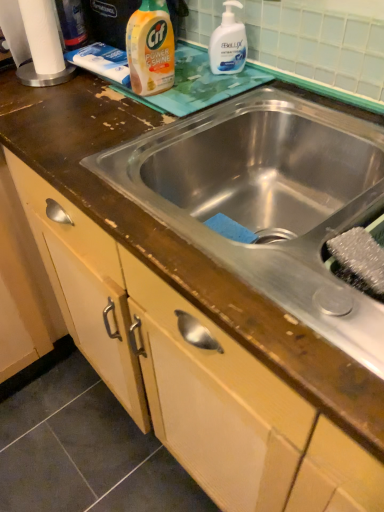
The height and width of the screenshot is (512, 384). I want to click on yellow plastic bottle at upper center, marked as the first cleaning product in a left-to-right arrangement, so click(150, 48).

What are the coordinates of `stainless steel sink at center` in the screenshot? It's located at (268, 200).

At what (x,y) coordinates should I click in order to perform the action: click on white paper towel at upper left. Please return your answer as a coordinate pair (x, y). This screenshot has width=384, height=512. Looking at the image, I should click on (42, 36).

Which object is closer to the camera taking this photo, stainless steel sink at center or white glossy hand soap at upper right, which ranks as the second cleaning product in left-to-right order?

stainless steel sink at center is in front.

Considering the relative positions of stainless steel sink at center and white glossy hand soap at upper right, the first cleaning product when ordered from right to left, in the image provided, is stainless steel sink at center to the left or to the right of white glossy hand soap at upper right, the first cleaning product when ordered from right to left,?

stainless steel sink at center is positioned on white glossy hand soap at upper right, the first cleaning product when ordered from right to left,'s right side.

Is point (196, 148) positioned behind point (227, 54)?

No, it is not.

Is stainless steel sink at center positioned with its back to white glossy hand soap at upper right, the first cleaning product when ordered from right to left?

No.

Considering the relative positions of stainless steel sink at center and white paper towel at upper left in the image provided, is stainless steel sink at center to the left of white paper towel at upper left from the viewer's perspective?

Incorrect, stainless steel sink at center is not on the left side of white paper towel at upper left.

Locate an element on the screen. toilet paper located above the stainless steel sink at center (from a real-world perspective) is located at coordinates (42, 36).

Does stainless steel sink at center turn towards white paper towel at upper left?

No, stainless steel sink at center is not aimed at white paper towel at upper left.

Looking at this image, is stainless steel sink at center positioned in front of white paper towel at upper left?

Yes, it is.

Considering the sizes of white glossy hand soap at upper right, the first cleaning product when ordered from right to left, and stainless steel sink at center in the image, is white glossy hand soap at upper right, the first cleaning product when ordered from right to left, wider or thinner than stainless steel sink at center?

In the image, white glossy hand soap at upper right, the first cleaning product when ordered from right to left, appears to be more narrow than stainless steel sink at center.

From the image's perspective, is white glossy hand soap at upper right, which ranks as the second cleaning product in left-to-right order, positioned above or below stainless steel sink at center?

white glossy hand soap at upper right, which ranks as the second cleaning product in left-to-right order, is situated higher than stainless steel sink at center in the image.

From a real-world perspective, between white glossy hand soap at upper right, the first cleaning product when ordered from right to left, and stainless steel sink at center, who is vertically higher?

In real-world perspective, white glossy hand soap at upper right, the first cleaning product when ordered from right to left, is above.

Which object is positioned more to the left, yellow plastic bottle at upper center, marked as the first cleaning product in a left-to-right arrangement, or white glossy hand soap at upper right, which ranks as the second cleaning product in left-to-right order?

yellow plastic bottle at upper center, marked as the first cleaning product in a left-to-right arrangement.

Is yellow plastic bottle at upper center, the 2th cleaning product positioned from the right, inside or outside of white glossy hand soap at upper right, the first cleaning product when ordered from right to left?

The correct answer is: outside.

Is yellow plastic bottle at upper center, marked as the first cleaning product in a left-to-right arrangement, wider than white glossy hand soap at upper right, the first cleaning product when ordered from right to left?

No.

Does yellow plastic bottle at upper center, the 2th cleaning product positioned from the right, have a greater height compared to white glossy hand soap at upper right, the first cleaning product when ordered from right to left?

Yes.

Which is behind, stainless steel sink at center or yellow plastic bottle at upper center, the 2th cleaning product positioned from the right?

Positioned behind is yellow plastic bottle at upper center, the 2th cleaning product positioned from the right.

Based on the photo, could you measure the distance between stainless steel sink at center and yellow plastic bottle at upper center, marked as the first cleaning product in a left-to-right arrangement?

stainless steel sink at center and yellow plastic bottle at upper center, marked as the first cleaning product in a left-to-right arrangement, are 12.17 inches apart.

Looking at this image, is stainless steel sink at center oriented towards yellow plastic bottle at upper center, the 2th cleaning product positioned from the right?

No.

Is stainless steel sink at center to the right of yellow plastic bottle at upper center, the 2th cleaning product positioned from the right, from the viewer's perspective?

Yes.

From a real-world perspective, which is physically below, white paper towel at upper left or stainless steel sink at center?

stainless steel sink at center.

Is white paper towel at upper left located outside stainless steel sink at center?

Indeed, white paper towel at upper left is completely outside stainless steel sink at center.

Considering the points (39, 10) and (220, 108), which point is behind, point (39, 10) or point (220, 108)?

Positioned behind is point (39, 10).

From the image's perspective, is white paper towel at upper left positioned above or below white glossy hand soap at upper right, which ranks as the second cleaning product in left-to-right order?

Clearly, from the image's perspective, white paper towel at upper left is above white glossy hand soap at upper right, which ranks as the second cleaning product in left-to-right order.

Looking at the image, does white paper towel at upper left seem bigger or smaller compared to white glossy hand soap at upper right, which ranks as the second cleaning product in left-to-right order?

In the image, white paper towel at upper left appears to be larger than white glossy hand soap at upper right, which ranks as the second cleaning product in left-to-right order.

Is white paper towel at upper left looking in the opposite direction of white glossy hand soap at upper right, which ranks as the second cleaning product in left-to-right order?

No.

Locate an element on the screen. This screenshot has width=384, height=512. the 1st cleaning product located above the stainless steel sink at center (from a real-world perspective) is located at coordinates (228, 42).

Locate an element on the screen. This screenshot has width=384, height=512. sink in front of the white paper towel at upper left is located at coordinates (268, 200).

Considering their positions, is white paper towel at upper left positioned closer to yellow plastic bottle at upper center, marked as the first cleaning product in a left-to-right arrangement, than stainless steel sink at center?

Among the two, white paper towel at upper left is located nearer to yellow plastic bottle at upper center, marked as the first cleaning product in a left-to-right arrangement.

Which object lies further to the anchor point white paper towel at upper left, white glossy hand soap at upper right, which ranks as the second cleaning product in left-to-right order, or stainless steel sink at center?

Among the two, stainless steel sink at center is located further to white paper towel at upper left.

Considering their positions, is white glossy hand soap at upper right, which ranks as the second cleaning product in left-to-right order, positioned closer to stainless steel sink at center than white paper towel at upper left?

white glossy hand soap at upper right, which ranks as the second cleaning product in left-to-right order, lies closer to stainless steel sink at center than the other object.

Looking at the image, which one is located closer to stainless steel sink at center, white paper towel at upper left or white glossy hand soap at upper right, the first cleaning product when ordered from right to left?

Among the two, white glossy hand soap at upper right, the first cleaning product when ordered from right to left, is located nearer to stainless steel sink at center.

Based on their spatial positions, is stainless steel sink at center or yellow plastic bottle at upper center, marked as the first cleaning product in a left-to-right arrangement, closer to white paper towel at upper left?

Among the two, yellow plastic bottle at upper center, marked as the first cleaning product in a left-to-right arrangement, is located nearer to white paper towel at upper left.

Considering their positions, is yellow plastic bottle at upper center, the 2th cleaning product positioned from the right, positioned further to stainless steel sink at center than white glossy hand soap at upper right, the first cleaning product when ordered from right to left?

white glossy hand soap at upper right, the first cleaning product when ordered from right to left, lies further to stainless steel sink at center than the other object.

From the image, which object appears to be farther from white paper towel at upper left, yellow plastic bottle at upper center, marked as the first cleaning product in a left-to-right arrangement, or stainless steel sink at center?

stainless steel sink at center.

Which object lies nearer to the anchor point yellow plastic bottle at upper center, marked as the first cleaning product in a left-to-right arrangement, white glossy hand soap at upper right, which ranks as the second cleaning product in left-to-right order, or white paper towel at upper left?

white glossy hand soap at upper right, which ranks as the second cleaning product in left-to-right order, is positioned closer to the anchor yellow plastic bottle at upper center, marked as the first cleaning product in a left-to-right arrangement.

You are a GUI agent. You are given a task and a screenshot of the screen. Output one action in this format:
    pyautogui.click(x=<x>, y=<y>)
    Task: Click on the cleaning product between white glossy hand soap at upper right, which ranks as the second cleaning product in left-to-right order, and stainless steel sink at center from top to bottom
    
    Given the screenshot: What is the action you would take?
    pyautogui.click(x=150, y=48)

Where is `cleaning product situated between white paper towel at upper left and white glossy hand soap at upper right, the first cleaning product when ordered from right to left, from left to right`? The width and height of the screenshot is (384, 512). cleaning product situated between white paper towel at upper left and white glossy hand soap at upper right, the first cleaning product when ordered from right to left, from left to right is located at coordinates (150, 48).